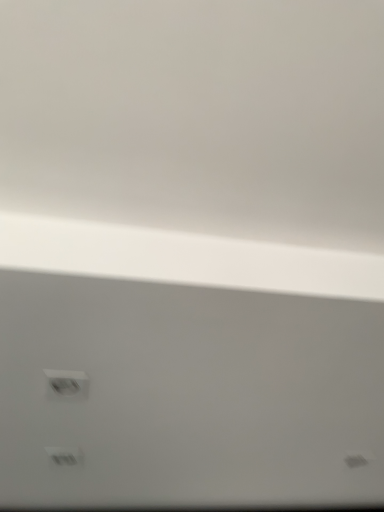
Locate an element on the screen. white matte vent at lower left is located at coordinates (186, 396).

What do you see at coordinates (186, 396) in the screenshot?
I see `white matte vent at lower left` at bounding box center [186, 396].

Image resolution: width=384 pixels, height=512 pixels. What are the coordinates of `white matte vent at lower left` in the screenshot? It's located at (186, 396).